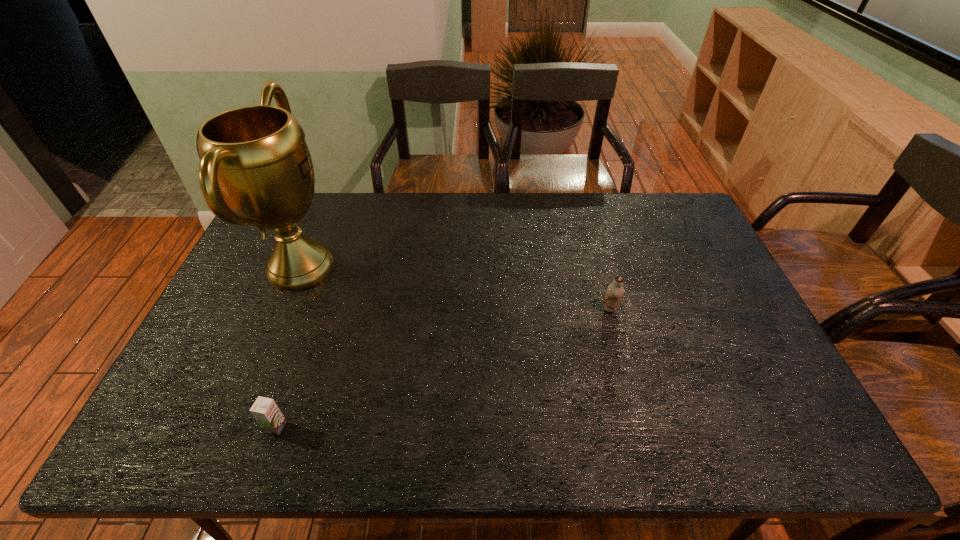
Where is `vacant space that is in between the tallest object and the shortest object`? This screenshot has width=960, height=540. vacant space that is in between the tallest object and the shortest object is located at coordinates (288, 347).

This screenshot has width=960, height=540. I want to click on vacant space that's between the shorter chocolate milk and the farther chocolate milk, so click(443, 368).

The image size is (960, 540). In order to click on free space between the trophy cup and the shortest object in this screenshot , I will do `click(288, 347)`.

In order to click on empty space that is in between the shorter chocolate milk and the tallest object in this screenshot , I will do `click(288, 347)`.

The width and height of the screenshot is (960, 540). Identify the location of empty space that is in between the farther chocolate milk and the nearer chocolate milk. (443, 368).

I want to click on the closest object to the farther chocolate milk, so click(x=255, y=159).

Identify which object is the second nearest to the right chocolate milk. Please provide its 2D coordinates. Your answer should be formatted as a tuple, i.e. [(x, y)], where the tuple contains the x and y coordinates of a point satisfying the conditions above.

[(265, 411)]

In order to click on vacant space that satisfies the following two spatial constraints: 1. on the surface of the shorter chocolate milk with symbols; 2. on the right side of the tallest object in this screenshot , I will do `click(234, 427)`.

This screenshot has width=960, height=540. Find the location of `free spot that satisfies the following two spatial constraints: 1. on the surface of the trophy cup with symbols; 2. on the left side of the left chocolate milk`. free spot that satisfies the following two spatial constraints: 1. on the surface of the trophy cup with symbols; 2. on the left side of the left chocolate milk is located at coordinates (234, 427).

The height and width of the screenshot is (540, 960). In order to click on free point that satisfies the following two spatial constraints: 1. on the surface of the shortest object with symbols; 2. on the left side of the tallest object in this screenshot , I will do `click(234, 427)`.